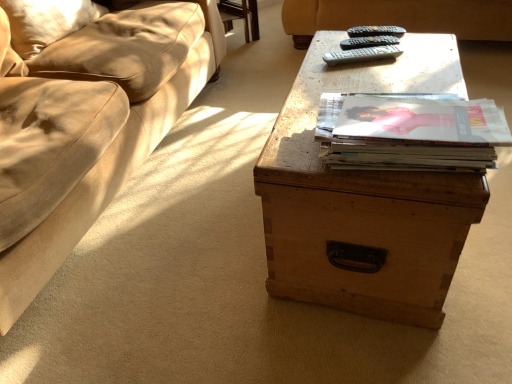
You are a GUI agent. You are given a task and a screenshot of the screen. Output one action in this format:
    pyautogui.click(x=<x>, y=<y>)
    Task: Click on the space that is in front of black plastic remote at upper center, the second remote when ordered from bottom to top
    This screenshot has width=512, height=384.
    Given the screenshot: What is the action you would take?
    pyautogui.click(x=404, y=68)